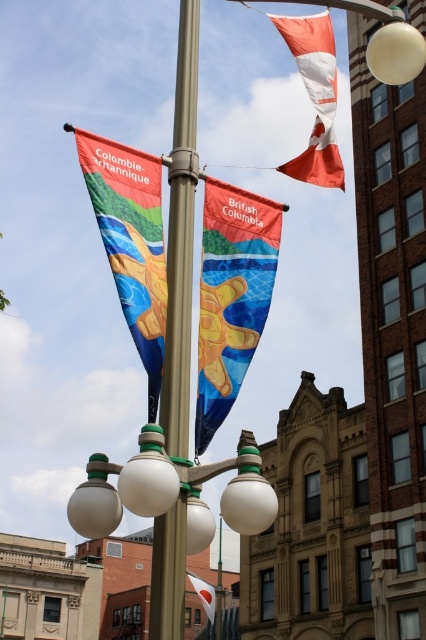
You are standing at the base of the lamppost and want to reach the matte fabric flag at upper left. Which direction should you look to find it?

The matte fabric flag at upper left is located at point (131,241), so you should look to the upper left direction to find it.

You are a photographer trying to capture the white glossy street light at center and the matte fabric flag at upper left in your shot. Which object appears narrower in the photo?

The white glossy street light at center appears narrower in the photo because it is thinner than the matte fabric flag at upper left.

You are a drone operator trying to capture a photo of both the matte fabric flag at upper left and the white fabric flag at lower center in the same frame. The drone can only capture objects within a 100 feet distance range. Can you determine if both flags will fit in the frame?

The matte fabric flag at upper left and white fabric flag at lower center are 126.16 feet apart, which exceeds the drone camera range of 100 feet. Therefore, both flags cannot be captured in the same frame.